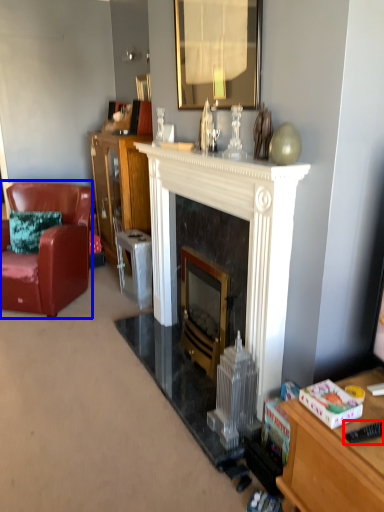
Question: Among these objects, which one is nearest to the camera, remote control (highlighted by a red box) or chair (highlighted by a blue box)?

Choices:
 (A) remote control
 (B) chair

Answer: (A)